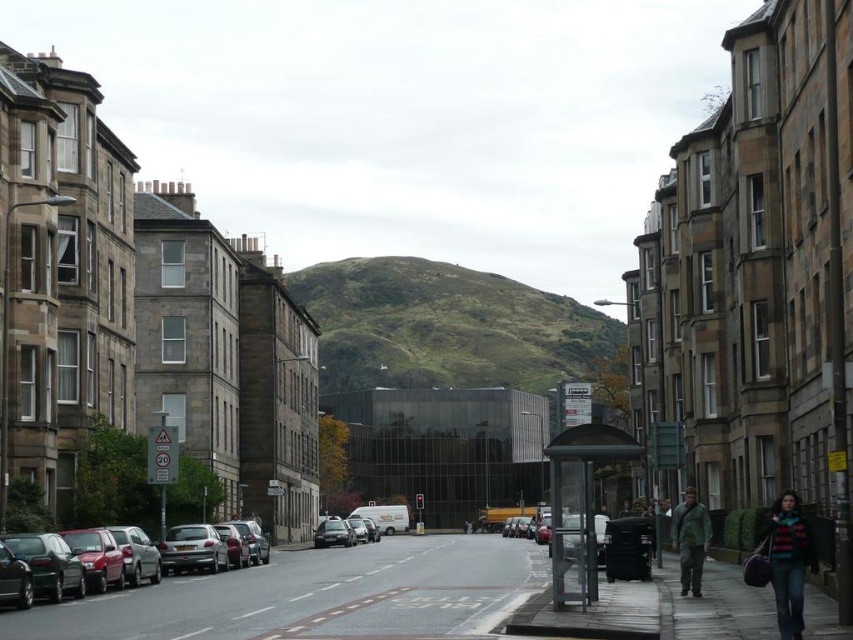
Is concrete sidewalk at center to the left of striped sweater at lower right from the viewer's perspective?

Yes, concrete sidewalk at center is to the left of striped sweater at lower right.

Is concrete sidewalk at center wider than striped sweater at lower right?

Yes, concrete sidewalk at center is wider than striped sweater at lower right.

Is point (326, 577) farther from camera compared to point (785, 632)?

That is True.

Find the location of a particular element. Image resolution: width=853 pixels, height=640 pixels. concrete sidewalk at center is located at coordinates (334, 596).

Is point (549, 449) positioned after point (113, 552)?

That is False.

The width and height of the screenshot is (853, 640). Describe the element at coordinates (579, 506) in the screenshot. I see `metallic silver bus stop at center` at that location.

I want to click on metallic silver bus stop at center, so click(x=579, y=506).

What do you see at coordinates (579, 506) in the screenshot? I see `metallic silver bus stop at center` at bounding box center [579, 506].

Which of these two, metallic silver bus stop at center or silver metallic hatchback at lower left, stands taller?

metallic silver bus stop at center is taller.

Who is more distant from viewer, (608, 432) or (189, 556)?

Positioned behind is point (189, 556).

Identify the location of metallic silver bus stop at center. This screenshot has height=640, width=853. (579, 506).